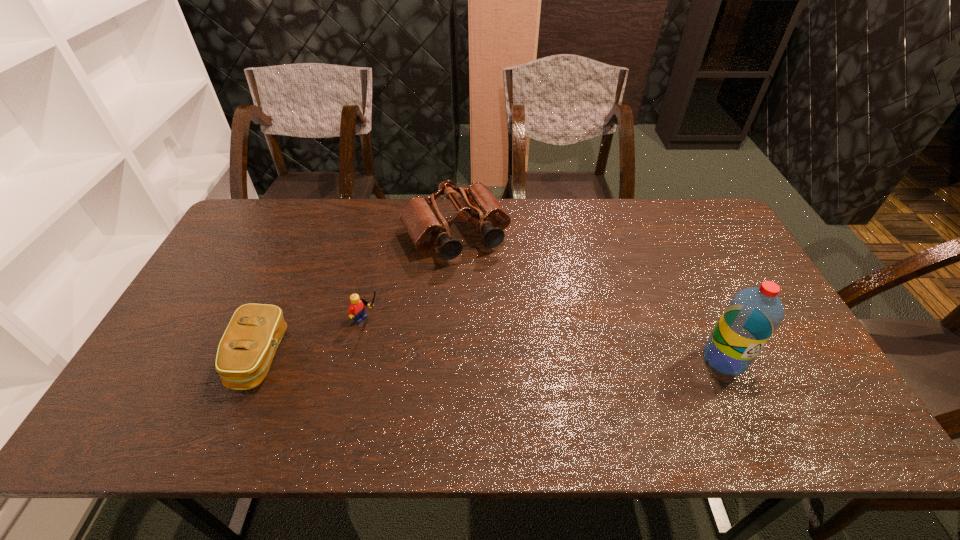
The image size is (960, 540). Find the location of `free space on the desktop that is between the leftmost object and the water bottle and is positioned through the eyepieces of the farthest object`. free space on the desktop that is between the leftmost object and the water bottle and is positioned through the eyepieces of the farthest object is located at coordinates (530, 358).

Find the location of a particular element. This screenshot has width=960, height=540. vacant spot on the desktop that is between the shortest object and the water bottle and is positioned on the front-facing side of the Lego is located at coordinates (427, 358).